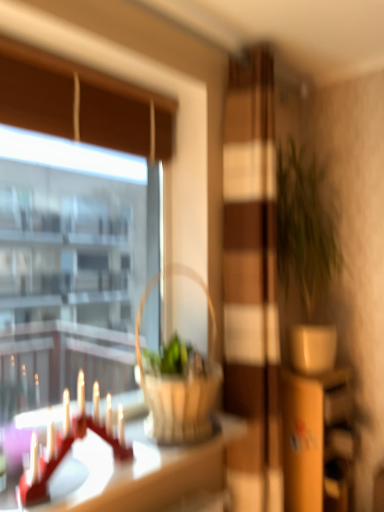
Locate an element on the screen. Image resolution: width=384 pixels, height=512 pixels. wooden screen door at center is located at coordinates (251, 282).

This screenshot has width=384, height=512. What are the coordinates of `matte red candle holder at left` in the screenshot? It's located at 69,448.

Identify the location of transparent glass window at upper left. [x=71, y=234].

The image size is (384, 512). I want to click on wooden screen door at center, so click(251, 282).

At what (x,y) coordinates should I click in order to perform the action: click on candle holder above the white glossy table at lower left (from the image's perspective). Please return your answer as a coordinate pair (x, y). The height and width of the screenshot is (512, 384). Looking at the image, I should click on (69, 448).

Is white glossy table at lower left touching matte red candle holder at left?

white glossy table at lower left and matte red candle holder at left are clearly separated.

Is white glossy table at lower left situated inside matte red candle holder at left or outside?

white glossy table at lower left is not inside matte red candle holder at left, it's outside.

Does white glossy table at lower left have a greater width compared to matte red candle holder at left?

Indeed, white glossy table at lower left has a greater width compared to matte red candle holder at left.

Is point (37, 237) farther from camera compared to point (176, 271)?

That is True.

Are transparent glass window at upper left and woven wood picnic basket at center located far from each other?

Yes, transparent glass window at upper left is far from woven wood picnic basket at center.

From a real-world perspective, is transparent glass window at upper left physically located above or below woven wood picnic basket at center?

Clearly, from a real-world perspective, transparent glass window at upper left is above woven wood picnic basket at center.

Would you say transparent glass window at upper left is inside or outside woven wood picnic basket at center?

transparent glass window at upper left is located beyond the bounds of woven wood picnic basket at center.

In the image, is wooden dresser at right positioned in front of or behind white glossy table at lower left?

wooden dresser at right is behind white glossy table at lower left.

Is wooden dresser at right wider than white glossy table at lower left?

No, wooden dresser at right is not wider than white glossy table at lower left.

From a real-world perspective, which object rests below the other?

wooden dresser at right is physically lower.

From the picture: From a real-world perspective, is woven wood picnic basket at center located beneath matte red candle holder at left?

Answer: No, from a real-world perspective, woven wood picnic basket at center is not under matte red candle holder at left.

Which is in front, woven wood picnic basket at center or matte red candle holder at left?

Positioned in front is matte red candle holder at left.

Is woven wood picnic basket at center not near matte red candle holder at left?

They are positioned close to each other.

Which of these two, wooden dresser at right or matte red candle holder at left, is smaller?

matte red candle holder at left is smaller.

Is wooden dresser at right not within matte red candle holder at left?

Yes, wooden dresser at right is not within matte red candle holder at left.

Which object is wider, wooden dresser at right or matte red candle holder at left?

wooden dresser at right is wider.

From the image's perspective, is wooden dresser at right located beneath matte red candle holder at left?

Indeed, from the image's perspective, wooden dresser at right is shown beneath matte red candle holder at left.

Is white glossy table at lower left taller than transparent glass window at upper left?

No.

Is point (85, 461) closer to viewer compared to point (72, 193)?

That is True.

Is white glossy table at lower left positioned with its back to transparent glass window at upper left?

No, white glossy table at lower left is not facing the opposite direction of transparent glass window at upper left.

Consider the image. Considering the sizes of white glossy table at lower left and transparent glass window at upper left in the image, is white glossy table at lower left wider or thinner than transparent glass window at upper left?

Clearly, white glossy table at lower left has more width compared to transparent glass window at upper left.

Is point (33, 489) positioned after point (152, 289)?

No, (33, 489) is in front of (152, 289).

Are matte red candle holder at left and woven wood picnic basket at center located far from each other?

Actually, matte red candle holder at left and woven wood picnic basket at center are a little close together.

Consider the image. Considering the relative sizes of matte red candle holder at left and woven wood picnic basket at center in the image provided, is matte red candle holder at left taller than woven wood picnic basket at center?

In fact, matte red candle holder at left may be shorter than woven wood picnic basket at center.

Which object is thinner, matte red candle holder at left or woven wood picnic basket at center?

matte red candle holder at left.

The height and width of the screenshot is (512, 384). In order to click on candle holder lying behind the white glossy table at lower left in this screenshot , I will do `click(69, 448)`.

Locate an element on the screen. The image size is (384, 512). window located on the left of woven wood picnic basket at center is located at coordinates (71, 234).

Based on their spatial positions, is green matte plant at right or white glossy table at lower left closer to transparent glass window at upper left?

Based on the image, green matte plant at right appears to be nearer to transparent glass window at upper left.

Based on their spatial positions, is white glossy table at lower left or green matte plant at right further from wooden screen door at center?

white glossy table at lower left is further to wooden screen door at center.

Which object lies nearer to the anchor point matte red candle holder at left, transparent glass window at upper left or woven wood picnic basket at center?

Among the two, woven wood picnic basket at center is located nearer to matte red candle holder at left.

Looking at the image, which one is located further to transparent glass window at upper left, white glossy table at lower left or wooden screen door at center?

white glossy table at lower left lies further to transparent glass window at upper left than the other object.

Based on their spatial positions, is woven wood picnic basket at center or white glossy table at lower left closer to wooden screen door at center?

The object closer to wooden screen door at center is woven wood picnic basket at center.

When comparing their distances from woven wood picnic basket at center, does green matte plant at right or wooden dresser at right seem further?

green matte plant at right is further to woven wood picnic basket at center.

When comparing their distances from woven wood picnic basket at center, does matte red candle holder at left or transparent glass window at upper left seem closer?

matte red candle holder at left is positioned closer to the anchor woven wood picnic basket at center.

Which object lies further to the anchor point white glossy table at lower left, woven wood picnic basket at center or green matte plant at right?

green matte plant at right.

You are a GUI agent. You are given a task and a screenshot of the screen. Output one action in this format:
    pyautogui.click(x=<x>, y=<y>)
    Task: Click on the screen door located between transparent glass window at upper left and wooden dresser at right in the left-right direction
    Image resolution: width=384 pixels, height=512 pixels.
    Given the screenshot: What is the action you would take?
    pyautogui.click(x=251, y=282)

Where is `picnic basket between white glossy table at lower left and wooden dresser at right`? picnic basket between white glossy table at lower left and wooden dresser at right is located at coordinates (179, 382).

I want to click on picnic basket between matte red candle holder at left and wooden screen door at center, so click(179, 382).

This screenshot has width=384, height=512. What are the coordinates of `houseplant between transparent glass window at upper left and wooden dresser at right in the horizontal direction` in the screenshot? It's located at (306, 251).